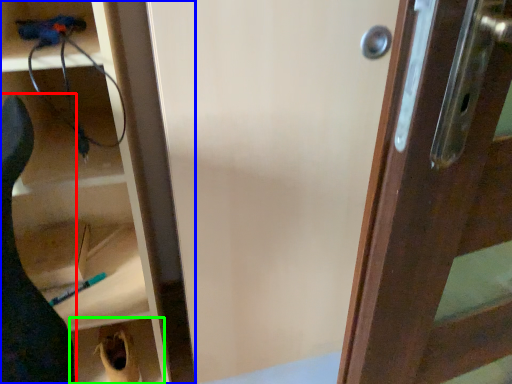
Question: Estimate the real-world distances between objects in this image. Which object is farther from animal (highlighted by a red box), cabinetry (highlighted by a blue box) or cabinetry (highlighted by a green box)?

Choices:
 (A) cabinetry
 (B) cabinetry

Answer: (B)